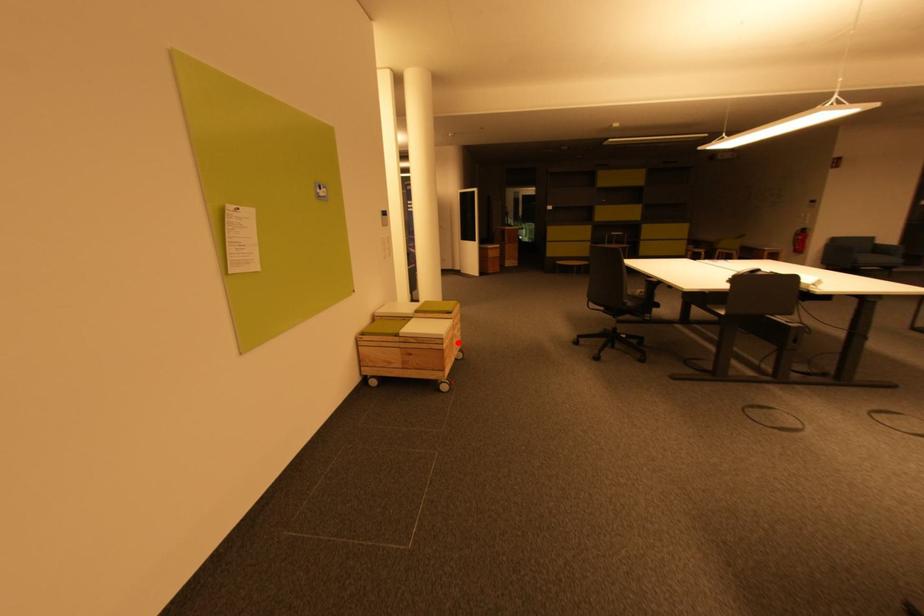
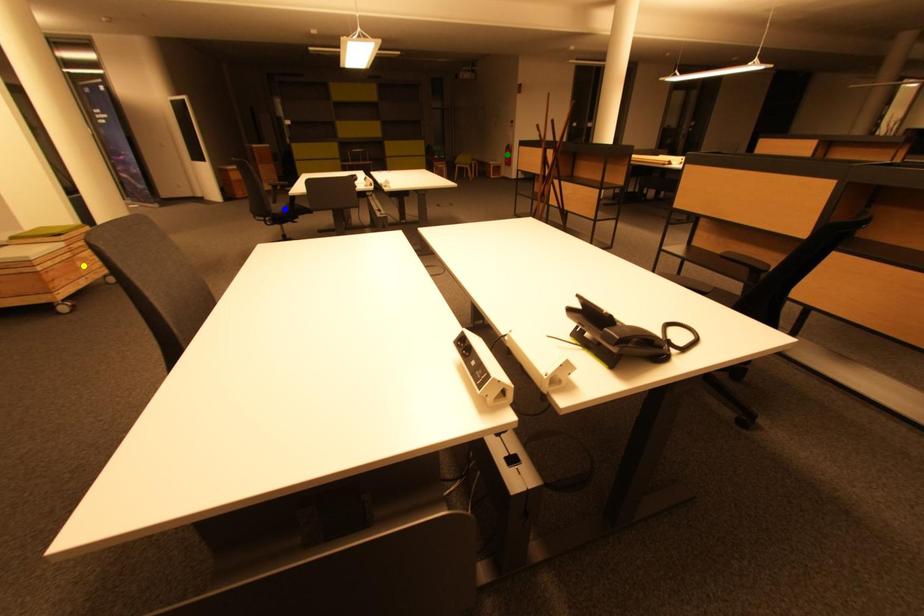
Question: I am providing you with two images of the same scene from different viewpoints. A red point is marked on the first image. You are given multiple points on the second image. Which mark in image 2 goes with the point in image 1?

Choices:
 (A) yellow point
 (B) blue point
 (C) green point

Answer: (A)